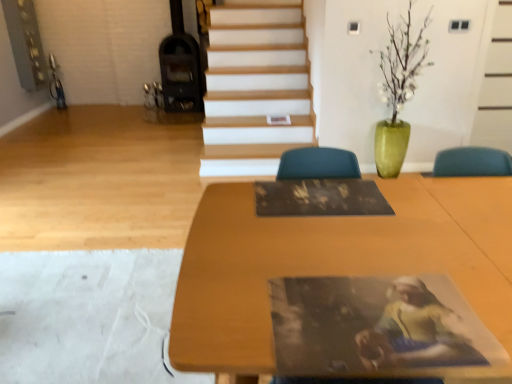
Locate an element on the screen. This screenshot has width=512, height=384. free spot above wooden table at center (from a real-world perspective) is located at coordinates (327, 261).